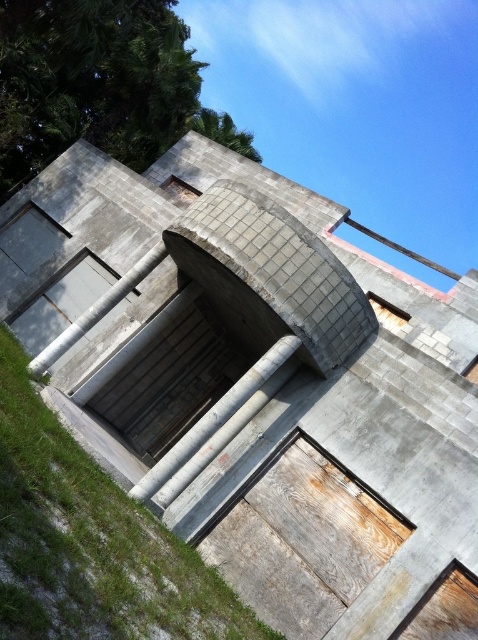
You are standing in front of the wooden door at center and want to take a photo with your camera. The camera requires a minimum distance of 5 meters to avoid blur. Can you take a clear photo without moving?

The wooden door at center and camera are 4.91 meters apart from each other. Since the minimum distance required is 5 meters, the camera is too close to take a clear photo without moving.